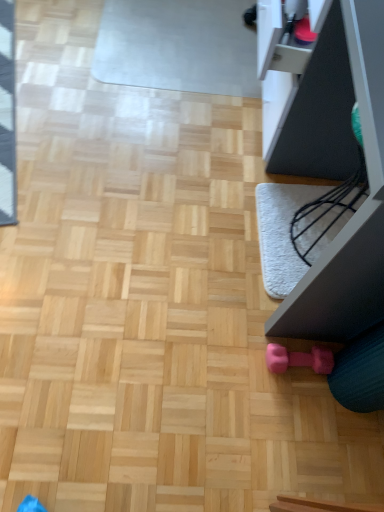
Question: Are pink rubber dumbbell at lower right and matte black monitor at right located far from each other?

Choices:
 (A) yes
 (B) no

Answer: (B)

Question: Is pink rubber dumbbell at lower right turned away from matte black monitor at right?

Choices:
 (A) yes
 (B) no

Answer: (B)

Question: Could you tell me if pink rubber dumbbell at lower right is facing matte black monitor at right?

Choices:
 (A) yes
 (B) no

Answer: (B)

Question: Is pink rubber dumbbell at lower right in contact with matte black monitor at right?

Choices:
 (A) yes
 (B) no

Answer: (B)

Question: From the image's perspective, is pink rubber dumbbell at lower right under matte black monitor at right?

Choices:
 (A) no
 (B) yes

Answer: (B)

Question: Does pink rubber dumbbell at lower right lie in front of matte black monitor at right?

Choices:
 (A) no
 (B) yes

Answer: (A)

Question: Is matte black monitor at right further to the viewer compared to pink rubber dumbbell at lower right?

Choices:
 (A) yes
 (B) no

Answer: (B)

Question: Does matte black monitor at right have a smaller size compared to pink rubber dumbbell at lower right?

Choices:
 (A) yes
 (B) no

Answer: (B)

Question: From the image's perspective, is matte black monitor at right over pink rubber dumbbell at lower right?

Choices:
 (A) no
 (B) yes

Answer: (B)

Question: Would you say matte black monitor at right is a long distance from pink rubber dumbbell at lower right?

Choices:
 (A) no
 (B) yes

Answer: (A)

Question: Considering the relative sizes of matte black monitor at right and pink rubber dumbbell at lower right in the image provided, is matte black monitor at right bigger than pink rubber dumbbell at lower right?

Choices:
 (A) no
 (B) yes

Answer: (B)

Question: From the image's perspective, does matte black monitor at right appear lower than pink rubber dumbbell at lower right?

Choices:
 (A) no
 (B) yes

Answer: (A)

Question: Would you say matte black monitor at right is inside or outside pink rubber dumbbell at lower right?

Choices:
 (A) inside
 (B) outside

Answer: (B)